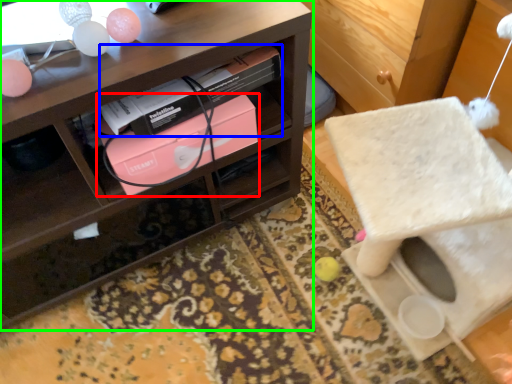
Question: Considering the real-world distances, which object is closest to box (highlighted by a red box)? book (highlighted by a blue box) or shelf (highlighted by a green box).

Choices:
 (A) book
 (B) shelf

Answer: (A)